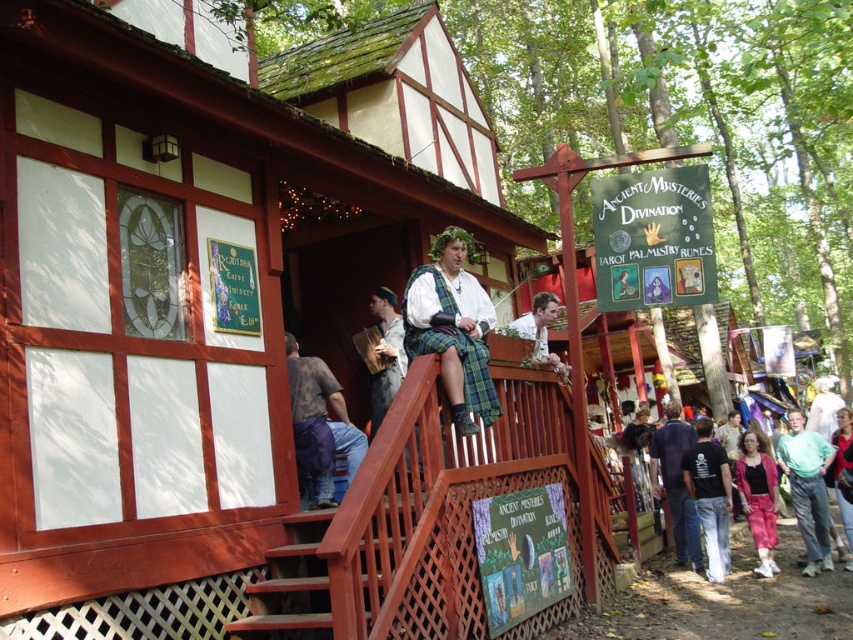
Looking at this image, you are standing at the entrance of the rustic wooden building with a red and white half timbered facade. You want to go to the brown wooden stairs at lower center. Which direction should you walk?

Walk towards the lower center direction to reach the brown wooden stairs at lower center.

You are a guest at this medieval event and want to take a photo with the person in the green cotton shirt at lower right. However, there is a matte green fabric at upper right blocking your view. Can you move to the left or right to get a clear shot?

Move to the left to get a clear shot of the green cotton shirt at lower right since it is to the right of the matte green fabric at upper right.

You are an artist trying to sketch the scene. You notice the brown cotton pants at lower center and the dark blue shirt at center. Which object should you draw first if you want to follow the rule of drawing smaller elements before larger ones?

The brown cotton pants at lower center has a lesser height compared to dark blue shirt at center, so you should draw the brown cotton pants at lower center first.